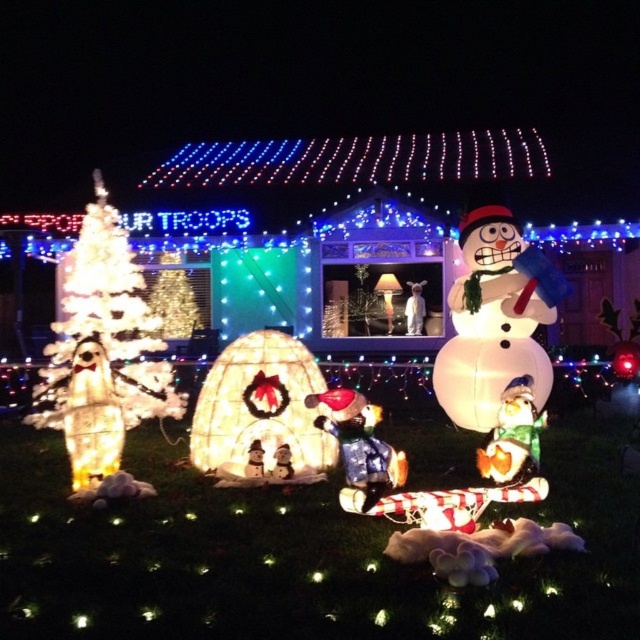
From the picture: Which is above, shiny blue snowman at center or shiny metallic snowman at center?

shiny metallic snowman at center

This screenshot has height=640, width=640. I want to click on shiny blue snowman at center, so 358,444.

Where is `shiny blue snowman at center`? This screenshot has height=640, width=640. shiny blue snowman at center is located at coordinates (358, 444).

Is inflatable white snowman at right below shiny blue snowman at center?

Incorrect, inflatable white snowman at right is not positioned below shiny blue snowman at center.

What are the coordinates of `inflatable white snowman at right` in the screenshot? It's located at (493, 320).

Which of these two, inflatable white snowman at right or shiny metallic snowman at center, stands shorter?

Answer: shiny metallic snowman at center is shorter.

Is inflatable white snowman at right thinner than shiny metallic snowman at center?

Incorrect, inflatable white snowman at right's width is not less than shiny metallic snowman at center's.

Is point (513, 253) less distant than point (484, 468)?

No, it is not.

The height and width of the screenshot is (640, 640). I want to click on inflatable white snowman at right, so click(493, 320).